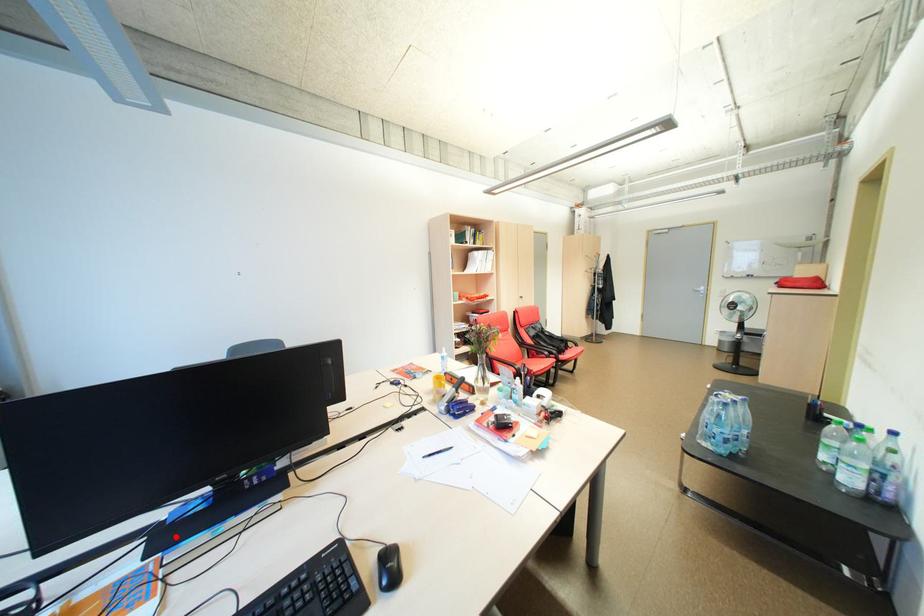
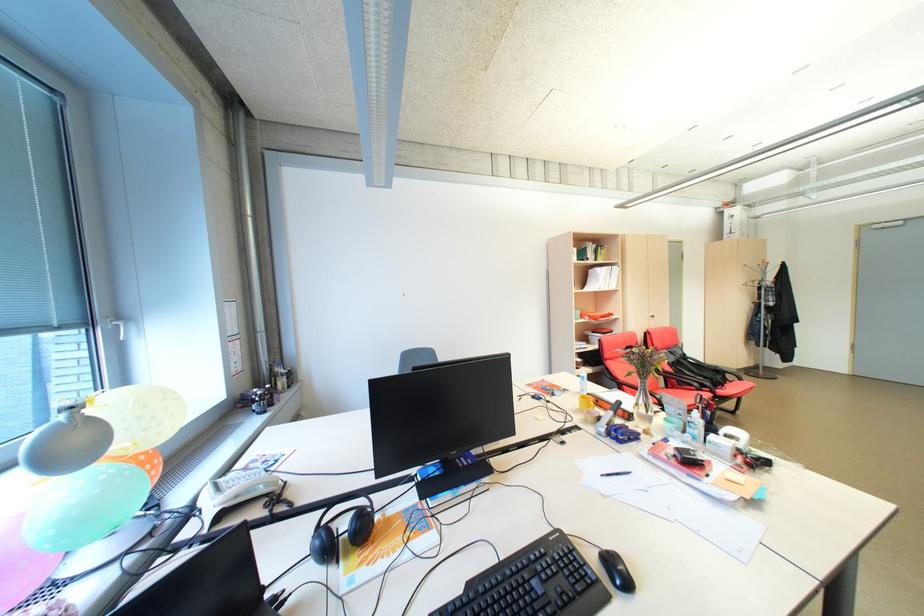
Where in the second image is the point corresponding to the highlighted location from the first image?

(435, 488)